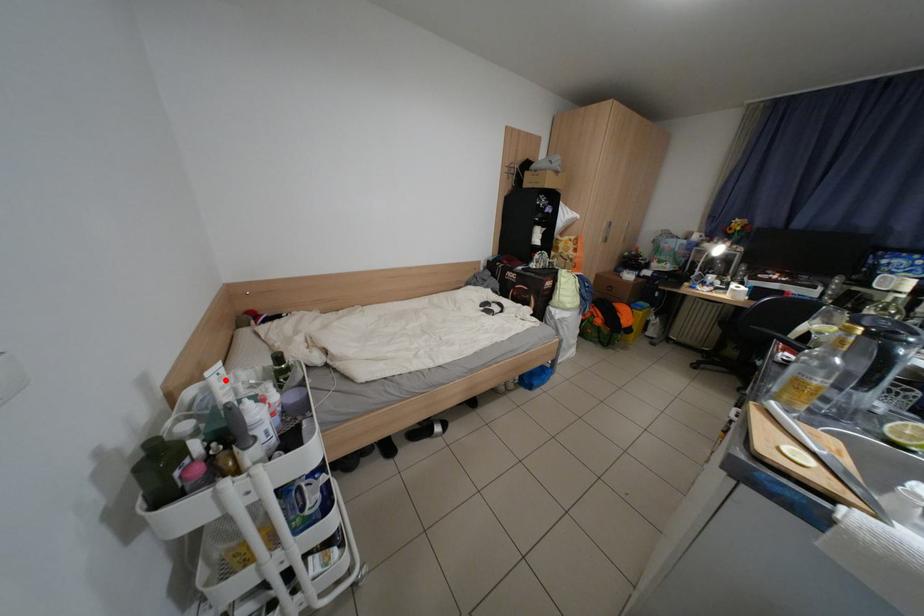
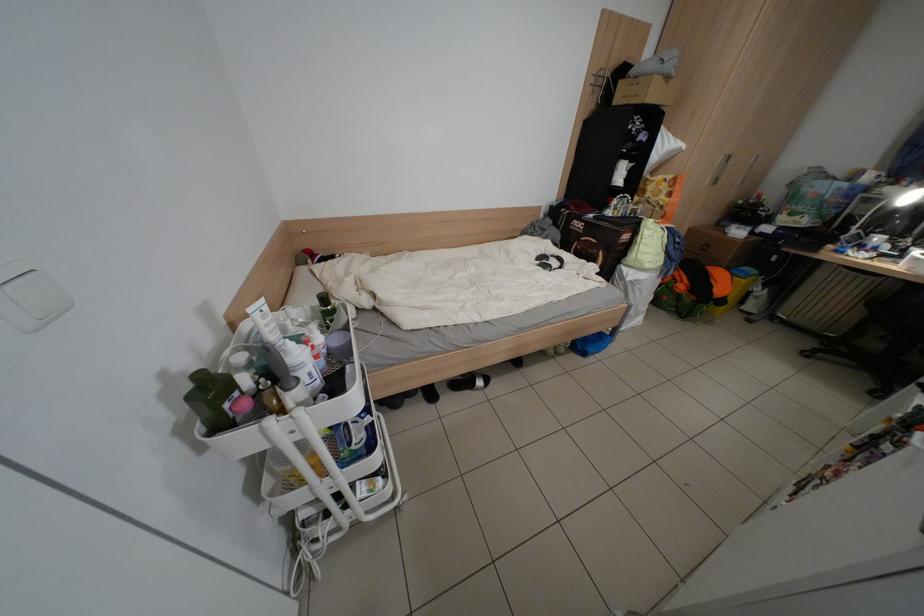
Where in the second image is the point corresponding to the highlighted location from the first image?

(268, 317)